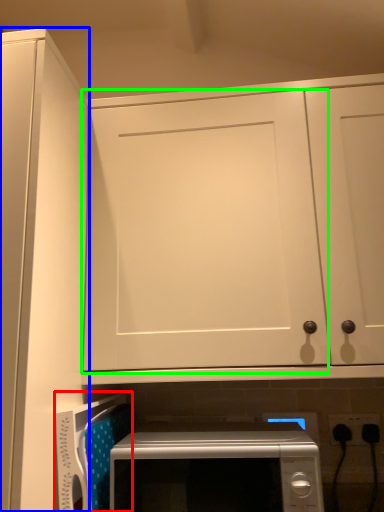
Question: Which object is the closest to the appliance (highlighted by a red box)? Choose among these: door (highlighted by a blue box) or door (highlighted by a green box).

Choices:
 (A) door
 (B) door

Answer: (A)